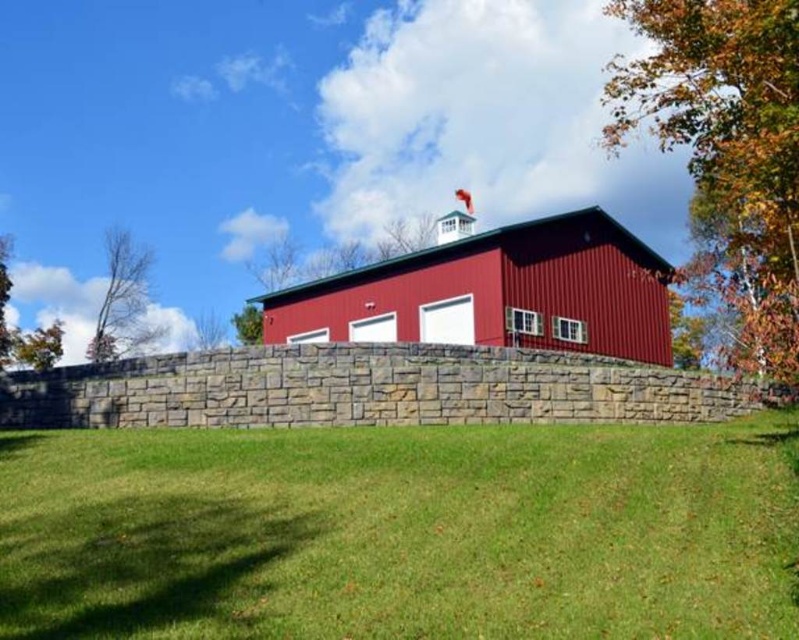
Who is taller, metallic red barn at center or bare branches at left?

bare branches at left

Does metallic red barn at center appear over bare branches at left?

Indeed, metallic red barn at center is positioned over bare branches at left.

Measure the distance between metallic red barn at center and camera.

metallic red barn at center and camera are 22.47 meters apart.

This screenshot has width=799, height=640. Find the location of `metallic red barn at center`. metallic red barn at center is located at coordinates (495, 292).

Does green grass at center appear on the left side of metallic red barn at center?

Yes, green grass at center is to the left of metallic red barn at center.

Does point (260, 579) lie behind point (487, 340)?

No, (260, 579) is closer to viewer.

Is point (754, 580) farther from viewer compared to point (670, 355)?

No, it is not.

The width and height of the screenshot is (799, 640). Identify the location of green grass at center. (400, 532).

Does green grass at center have a larger size compared to bare branches at left?

No, green grass at center is not bigger than bare branches at left.

Which is behind, point (181, 593) or point (134, 276)?

The point (134, 276) is behind.

What do you see at coordinates (400, 532) in the screenshot?
I see `green grass at center` at bounding box center [400, 532].

Find the location of a particular element. Image resolution: width=799 pixels, height=640 pixels. green grass at center is located at coordinates (400, 532).